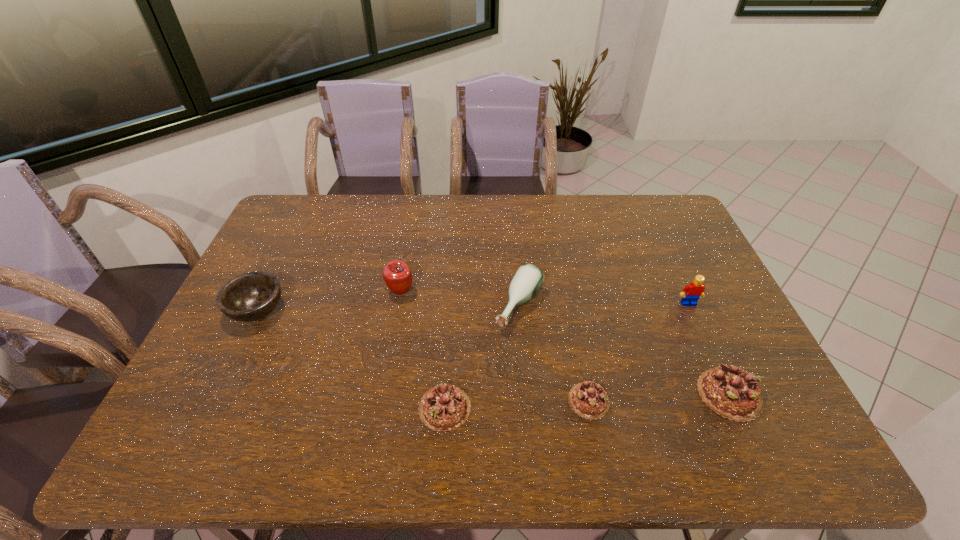
This screenshot has height=540, width=960. Find the location of `free space located 0.050m on the back of the third object from right to left`. free space located 0.050m on the back of the third object from right to left is located at coordinates (582, 366).

This screenshot has width=960, height=540. I want to click on vacant space located on the left of the rightmost chocolate cake, so click(581, 394).

The image size is (960, 540). Find the location of `free location located 0.080m on the left of the second object from left to right`. free location located 0.080m on the left of the second object from left to right is located at coordinates click(360, 291).

This screenshot has width=960, height=540. Find the location of `vacant space located 0.310m on the back of the fourth object from right to left`. vacant space located 0.310m on the back of the fourth object from right to left is located at coordinates (513, 220).

Where is `vacant space located on the right of the leftmost object`? The image size is (960, 540). vacant space located on the right of the leftmost object is located at coordinates (366, 310).

This screenshot has height=540, width=960. What are the coordinates of `vacant region located on the front-facing side of the Lego` in the screenshot? It's located at (704, 336).

Find the location of a particular element. The height and width of the screenshot is (540, 960). object that is positioned at the left edge is located at coordinates (251, 296).

At what (x,y) coordinates should I click in order to perform the action: click on chocolate cake present at the right edge. Please return your answer as a coordinate pair (x, y). Looking at the image, I should click on coord(731,392).

The image size is (960, 540). What are the coordinates of `Lego present at the right edge` in the screenshot? It's located at (691, 293).

At what (x,y) coordinates should I click in order to perform the action: click on object that is at the near right corner. Please return your answer as a coordinate pair (x, y). The width and height of the screenshot is (960, 540). Looking at the image, I should click on 731,392.